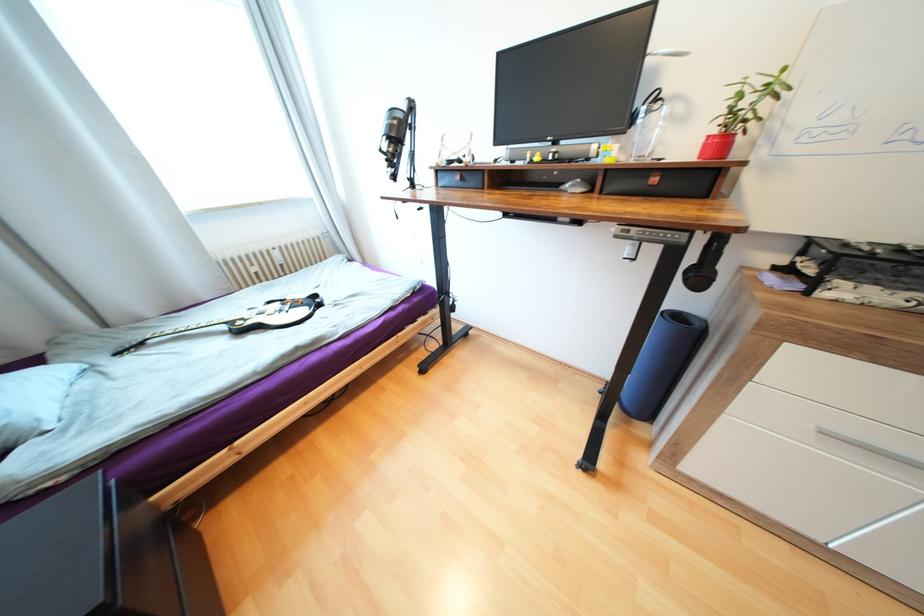
Find the location of a particular element. Image resolution: width=924 pixels, height=616 pixels. red plant pot is located at coordinates [716, 146].